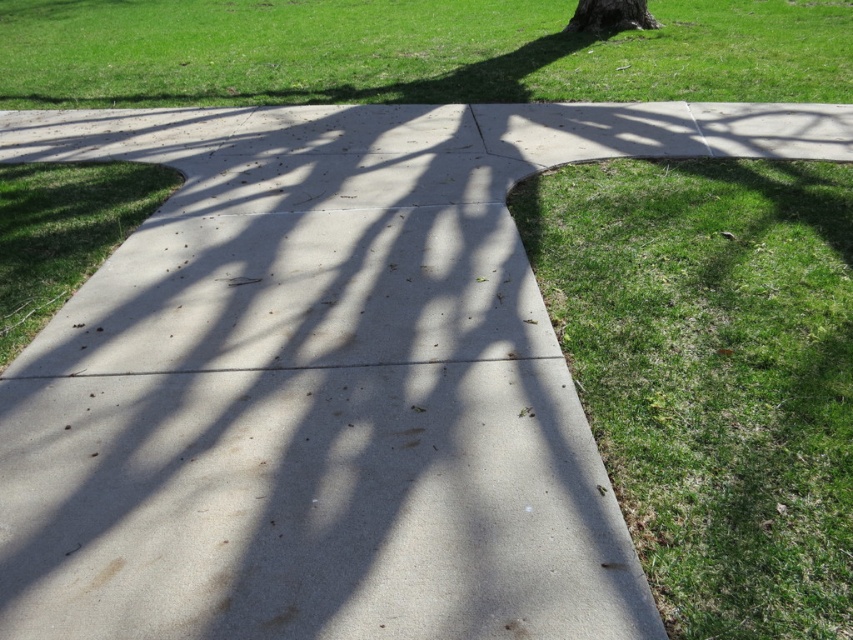
You are a gardener who wants to mow the green grass at upper center and trim the green rough bark tree at upper center. Which object is taller so you need a ladder to reach it?

The green grass at upper center is much taller than the green rough bark tree at upper center, so you need a ladder to reach the green grass at upper center.